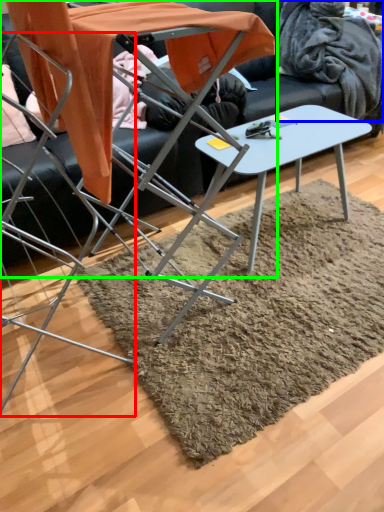
Question: Estimate the real-world distances between objects in this image. Which object is farther from chair (highlighted by a red box), blanket (highlighted by a blue box) or table (highlighted by a green box)?

Choices:
 (A) blanket
 (B) table

Answer: (A)